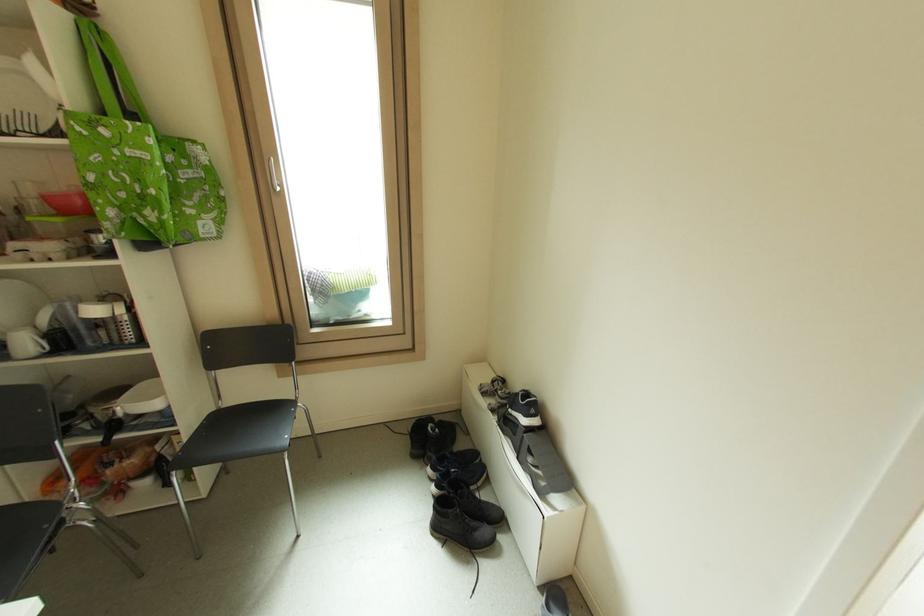
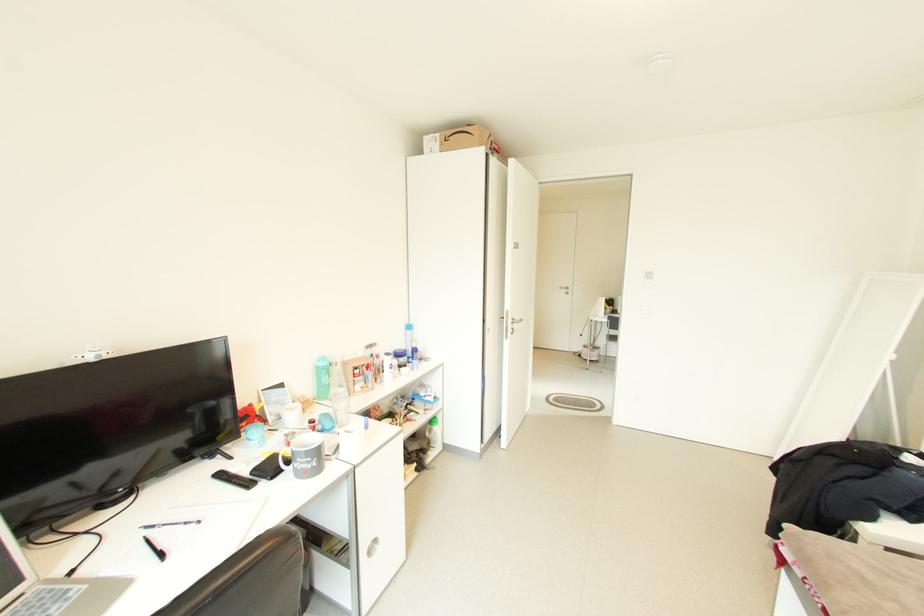
Question: I am providing you with two images of the same scene from different viewpoints. Please identify which objects are invisible in image2.

Choices:
 (A) black pen
 (B) frying pan handle
 (C) green water bottle
 (D) small cleaning bottle

Answer: (B)